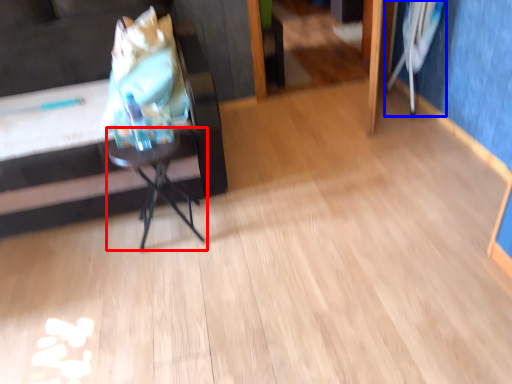
Question: Which object appears farthest to the camera in this image, table (highlighted by a red box) or swivel chair (highlighted by a blue box)?

Choices:
 (A) table
 (B) swivel chair

Answer: (B)